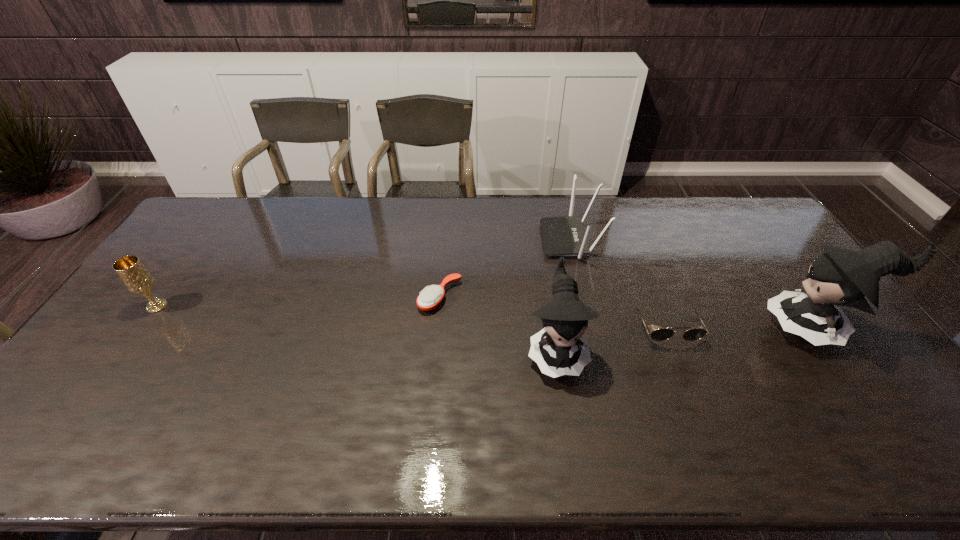
This screenshot has height=540, width=960. Identify the location of the shorter doll. (556, 349).

Locate an element on the screen. The height and width of the screenshot is (540, 960). the second tallest object is located at coordinates (556, 349).

Identify the location of the taller doll. This screenshot has height=540, width=960. (840, 276).

Where is `the rightmost object`? The height and width of the screenshot is (540, 960). the rightmost object is located at coordinates (840, 276).

This screenshot has height=540, width=960. I want to click on sunglasses, so click(x=661, y=334).

The image size is (960, 540). In order to click on the second object from right to left in this screenshot , I will do `click(661, 334)`.

Where is `the shortest object`? Image resolution: width=960 pixels, height=540 pixels. the shortest object is located at coordinates (430, 297).

Find the location of `the second object from left to right`. the second object from left to right is located at coordinates (430, 297).

Where is `the farthest object`? the farthest object is located at coordinates (562, 236).

The width and height of the screenshot is (960, 540). I want to click on chalice, so click(x=137, y=279).